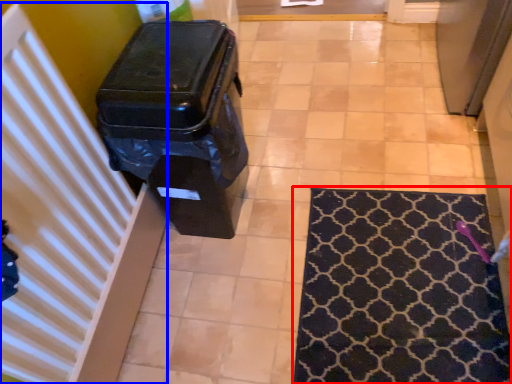
Question: Which object is closer to the camera taking this photo, mat (highlighted by a red box) or radiator (highlighted by a blue box)?

Choices:
 (A) mat
 (B) radiator

Answer: (B)